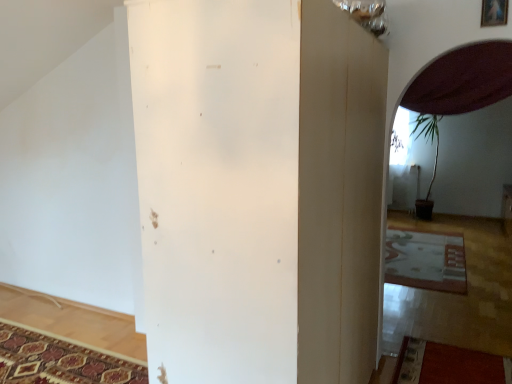
Question: Is white matte pillar at center in front of or behind patterned carpet at lower left, acting as the second mat starting from the right, in the image?

Choices:
 (A) behind
 (B) front

Answer: (B)

Question: Based on their sizes in the image, would you say white matte pillar at center is bigger or smaller than patterned carpet at lower left, acting as the second mat starting from the right?

Choices:
 (A) small
 (B) big

Answer: (B)

Question: Estimate the real-world distances between objects in this image. Which object is farther from the patterned carpet at lower right, the second mat when ordered from bottom to top?

Choices:
 (A) patterned carpet at lower left, which is the 1th mat in left-to-right order
 (B) wooden picture frame at upper right
 (C) white matte pillar at center

Answer: (C)

Question: Estimate the real-world distances between objects in this image. Which object is farther from the patterned carpet at lower right, which ranks as the 1th mat in right-to-left order?

Choices:
 (A) white matte pillar at center
 (B) patterned carpet at lower left, which is counted as the 2th mat, starting from the top
 (C) wooden picture frame at upper right

Answer: (A)